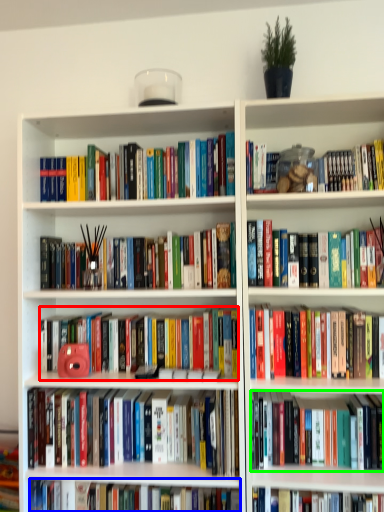
Question: Based on their relative distances, which object is nearer to book (highlighted by a red box)? Choose from book (highlighted by a blue box) and book (highlighted by a green box).

Choices:
 (A) book
 (B) book

Answer: (B)